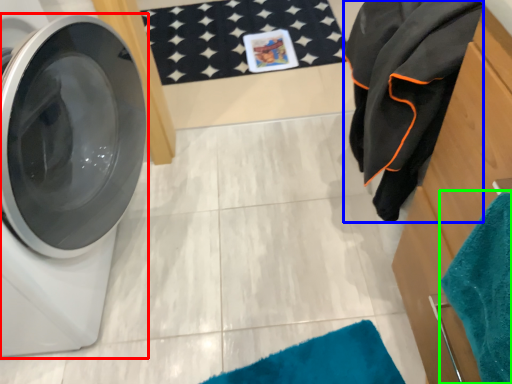
Question: Which object is positioned farthest from washing machine (highlighted by a red box)? Select from bath towel (highlighted by a blue box) and beach towel (highlighted by a green box).

Choices:
 (A) bath towel
 (B) beach towel

Answer: (B)